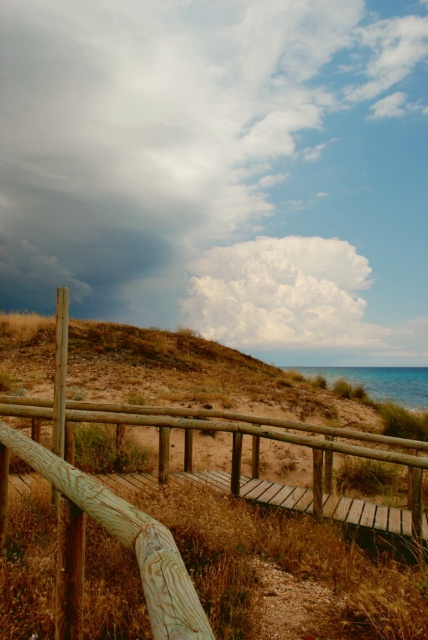
You are designing a model of this coastal scene. The wooden at center needs to be placed in relation to the white fluffy cloud at upper center. Based on their sizes, which object should be positioned closer to the front of the model?

The wooden at center is thinner than the white fluffy cloud at upper center, so the wooden at center should be placed closer to the front of the model to maintain the size relationship as seen in the original scene.

You are standing on the wooden walkway at center and looking up at the sky. Which object is higher in the scene, the wooden at center or the white fluffy cloud at upper center?

The white fluffy cloud at upper center is higher than the wooden at center because it is positioned above it in the sky.